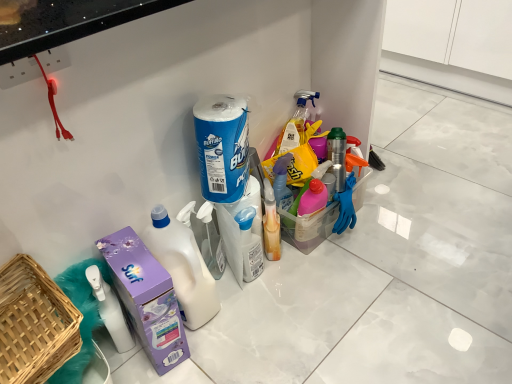
Question: Considering the relative positions of white plastic bottle at center and purple cardboard carton at lower left in the image provided, is white plastic bottle at center to the left or to the right of purple cardboard carton at lower left?

Choices:
 (A) right
 (B) left

Answer: (A)

Question: Is white plastic bottle at center wider or thinner than purple cardboard carton at lower left?

Choices:
 (A) wide
 (B) thin

Answer: (B)

Question: Estimate the real-world distances between objects in this image. Which object is closer to the purple cardboard carton at lower left?

Choices:
 (A) white plastic spray bottle at center, which ranks as the first cleaning product in bottom-to-top order
 (B) woven wood basket at lower left
 (C) white plastic bottle at center
 (D) blue paper towel roll at center, which is the first cleaning product from top to bottom

Answer: (C)

Question: Estimate the real-world distances between objects in this image. Which object is farther from the woven wood basket at lower left?

Choices:
 (A) white plastic spray bottle at center, which ranks as the first cleaning product in bottom-to-top order
 (B) purple cardboard carton at lower left
 (C) blue paper towel roll at center, the second cleaning product from the bottom
 (D) white plastic bottle at center

Answer: (A)